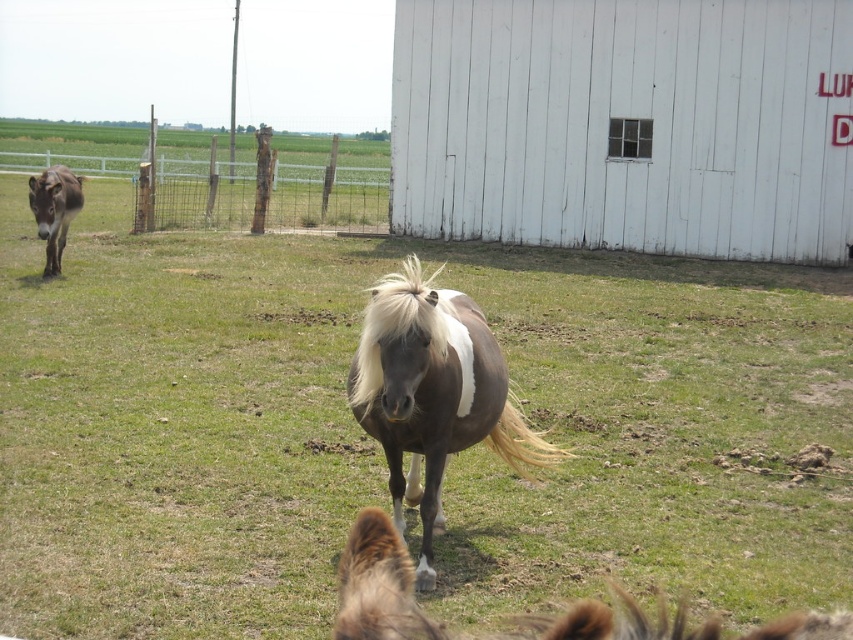
Is brown glossy horse at center behind shiny brown horse at center?

Yes.

Between point (477, 342) and point (399, 600), which one is positioned behind?

Point (477, 342)

This screenshot has width=853, height=640. What do you see at coordinates (433, 394) in the screenshot? I see `brown glossy horse at center` at bounding box center [433, 394].

Where is `brown glossy horse at center`? This screenshot has width=853, height=640. brown glossy horse at center is located at coordinates (433, 394).

Does white wooden barn at center lie in front of brown glossy horse at center?

No, white wooden barn at center is behind brown glossy horse at center.

Is white wooden barn at center shorter than brown glossy horse at center?

Indeed, white wooden barn at center has a lesser height compared to brown glossy horse at center.

Where is `white wooden barn at center`? The image size is (853, 640). white wooden barn at center is located at coordinates [x=625, y=124].

Find the location of a particular element. This screenshot has width=853, height=640. white wooden barn at center is located at coordinates (625, 124).

I want to click on green grassy at center, so click(378, 445).

Is green grassy at center taller than white wooden barn at center?

Correct, green grassy at center is much taller as white wooden barn at center.

Is point (781, 608) more distant than point (390, 154)?

No.

Where is `green grassy at center`? green grassy at center is located at coordinates (378, 445).